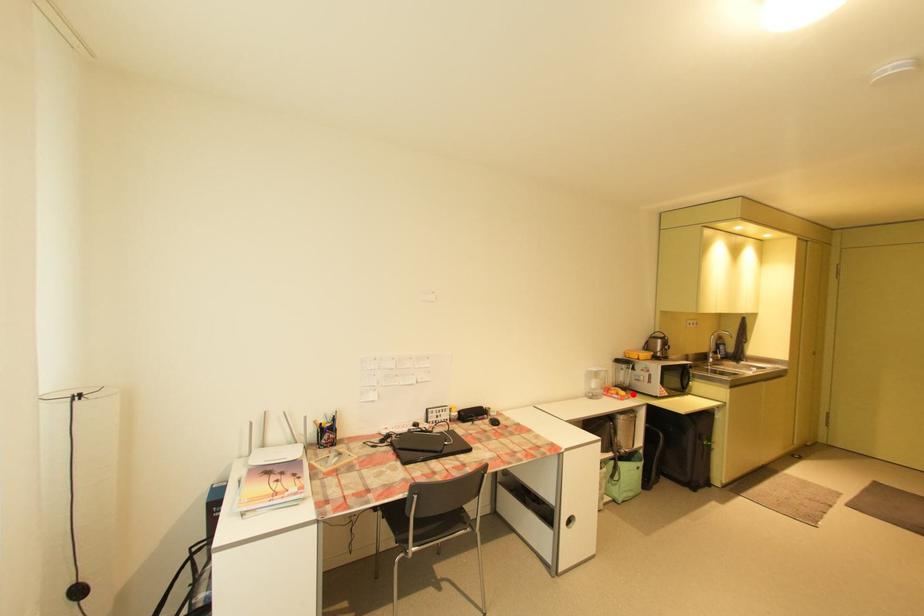
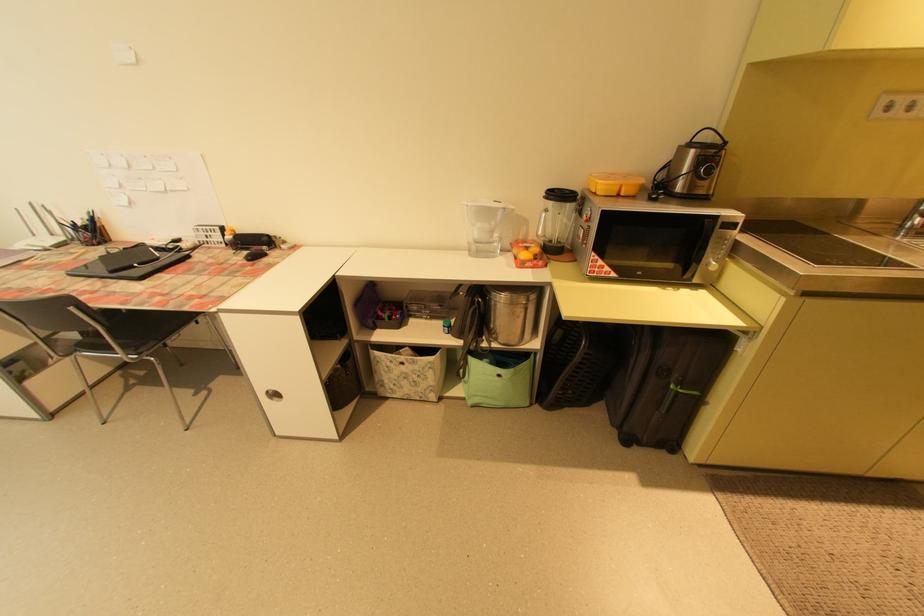
Question: I am providing you with two images of the same scene from different viewpoints. A red point is shown in image1. For the corresponding object point in image2, is it positioned nearer or farther from the camera?

Choices:
 (A) Nearer
 (B) Farther

Answer: (A)